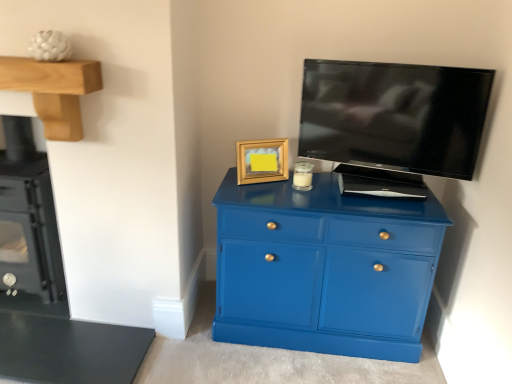
The image size is (512, 384). I want to click on empty space that is ontop of wooden mantel at upper left (from a real-world perspective), so 32,56.